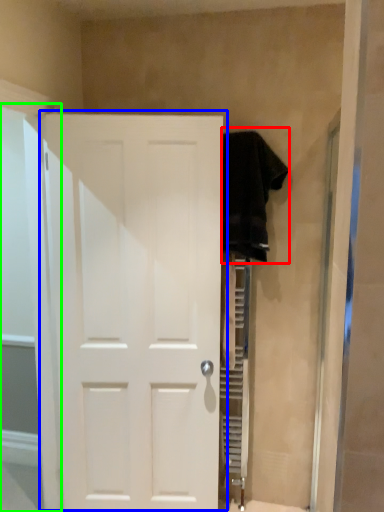
Question: Estimate the real-world distances between objects in this image. Which object is farther from clothing (highlighted by a red box), door (highlighted by a blue box) or glass door (highlighted by a green box)?

Choices:
 (A) door
 (B) glass door

Answer: (B)